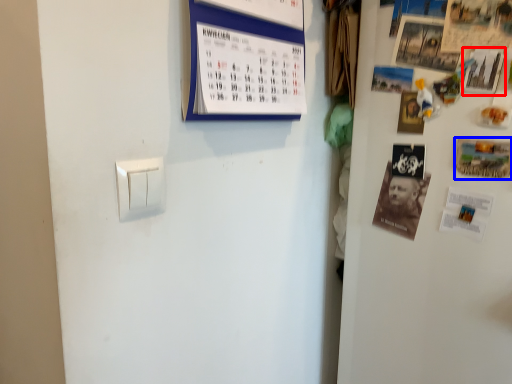
Question: Among these objects, which one is farthest to the camera, poster (highlighted by a red box) or postcard (highlighted by a blue box)?

Choices:
 (A) poster
 (B) postcard

Answer: (B)